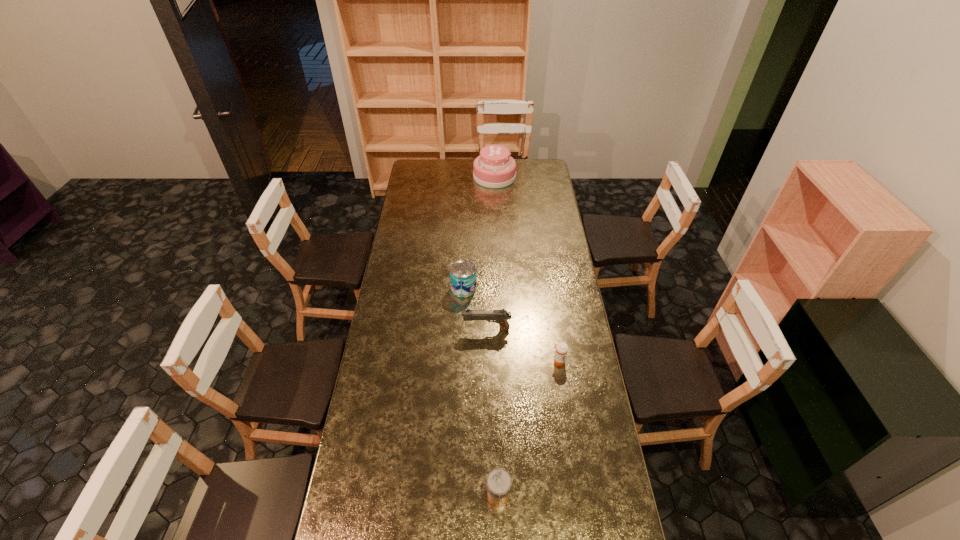
Locate an element on the screen. The height and width of the screenshot is (540, 960). birthday cake is located at coordinates (494, 168).

Image resolution: width=960 pixels, height=540 pixels. Find the location of `the farthest object`. the farthest object is located at coordinates (494, 168).

The image size is (960, 540). Find the location of `the third nearest object`. the third nearest object is located at coordinates coord(501,316).

Identify the location of the second farthest object. The image size is (960, 540). (463, 279).

Locate an element on the screen. the nearer medicine is located at coordinates (499, 482).

The width and height of the screenshot is (960, 540). I want to click on the nearest object, so click(x=499, y=482).

The image size is (960, 540). I want to click on the farther medicine, so click(561, 348).

Image resolution: width=960 pixels, height=540 pixels. Identify the location of the fourth farthest object. (561, 348).

This screenshot has width=960, height=540. Identify the location of vacant space located on the left of the birthday cake. (x=446, y=177).

The height and width of the screenshot is (540, 960). In order to click on vacant region located in the direction the third nearest object is aimed in this screenshot , I will do `click(397, 329)`.